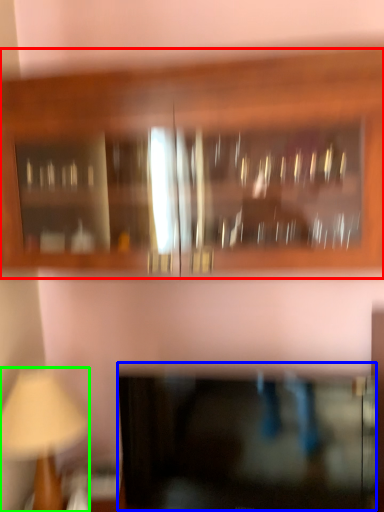
Question: Based on their relative distances, which object is farther from cabinetry (highlighted by a red box)? Choose from cabinetry (highlighted by a blue box) and table lamp (highlighted by a green box).

Choices:
 (A) cabinetry
 (B) table lamp

Answer: (B)